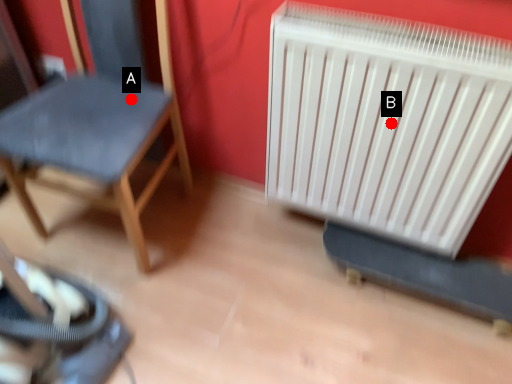
Question: Two points are circled on the image, labeled by A and B beside each circle. Which point appears farthest from the camera in this image?

Choices:
 (A) A is further
 (B) B is further

Answer: (A)